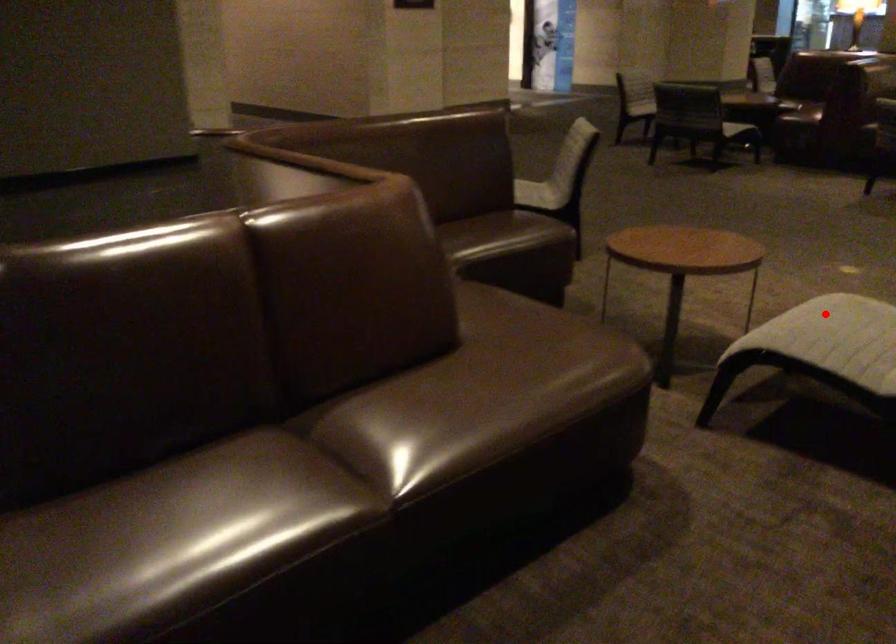
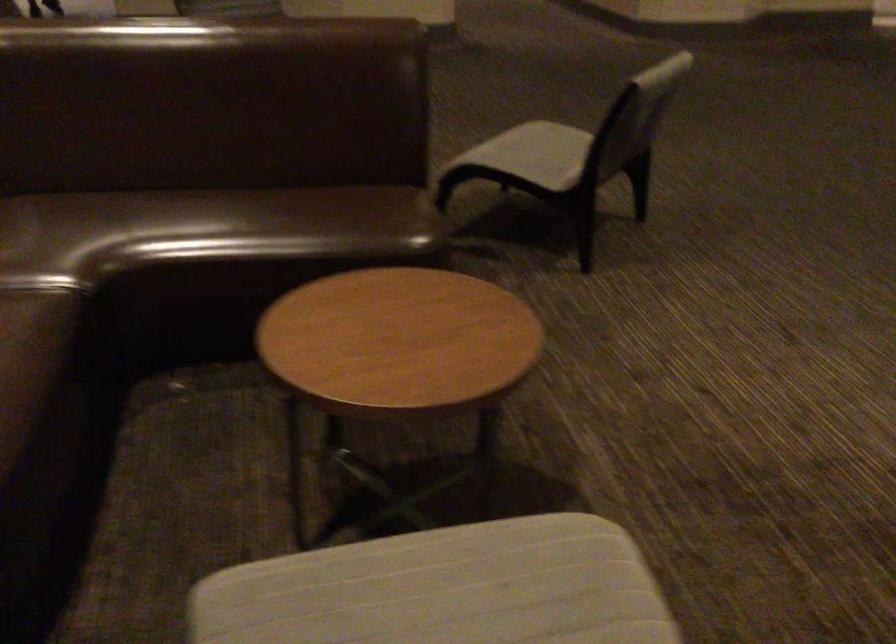
The point at the highlighted location is marked in the first image. Where is the corresponding point in the second image?

(444, 589)